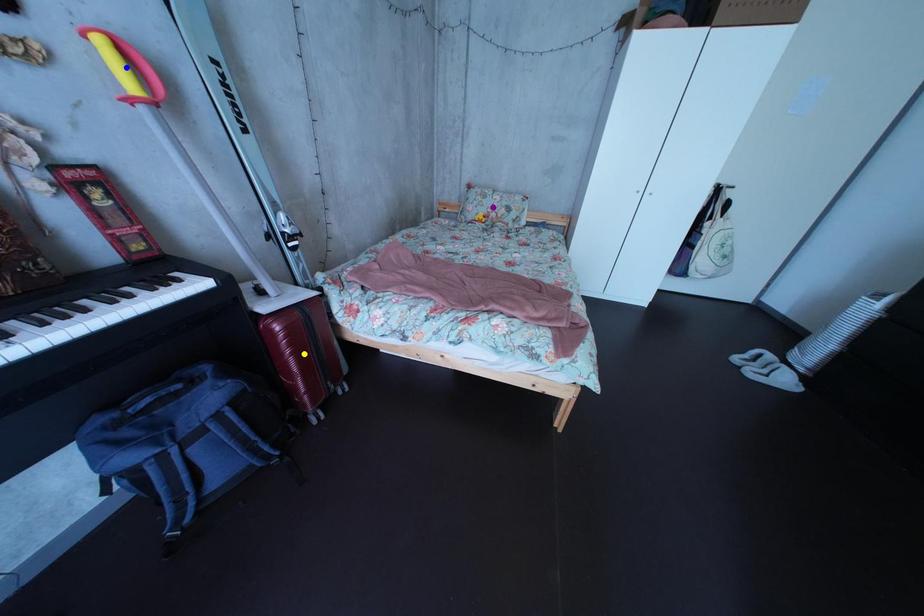
Order these from nearest to farthest:
1. yellow point
2. purple point
3. blue point

purple point → yellow point → blue point